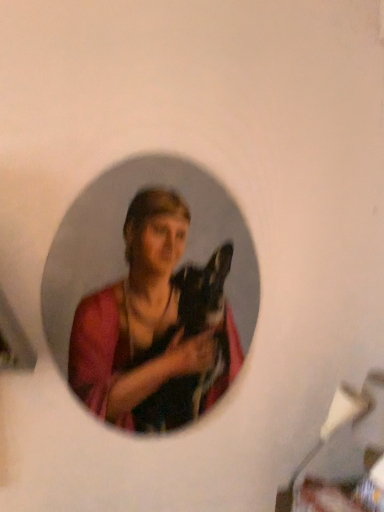
Image resolution: width=384 pixels, height=512 pixels. Identify the location of matte black dog at center. (136, 316).

This screenshot has height=512, width=384. What do you see at coordinates (136, 316) in the screenshot? I see `matte black dog at center` at bounding box center [136, 316].

Identify the location of matte black dog at center. (136, 316).